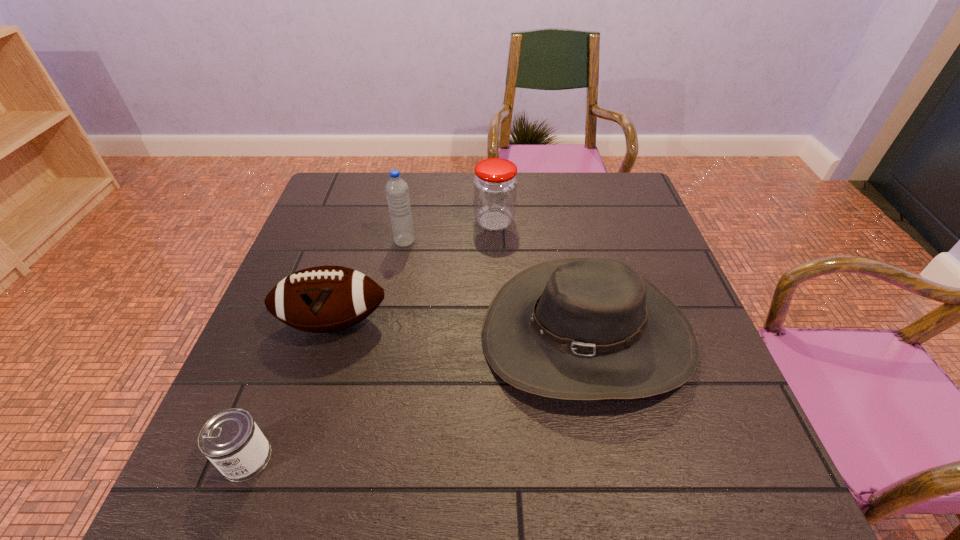
You are a GUI agent. You are given a task and a screenshot of the screen. Output one action in this format:
    pyautogui.click(x=<x>, y=<y>)
    Task: Click on the vacant space at the right edge
    The height and width of the screenshot is (540, 960).
    Given the screenshot: What is the action you would take?
    pyautogui.click(x=700, y=363)

Image resolution: width=960 pixels, height=540 pixels. What are the coordinates of `free space at the near left corner` in the screenshot? It's located at click(263, 498).

The height and width of the screenshot is (540, 960). I want to click on free region at the far right corner of the desktop, so 638,201.

This screenshot has height=540, width=960. Find the location of `vacant region at the near right corner of the desktop`. vacant region at the near right corner of the desktop is located at coordinates (725, 487).

This screenshot has height=540, width=960. What are the coordinates of `free space between the farthest object and the shortest object` in the screenshot? It's located at (371, 340).

Locate an element on the screen. This screenshot has width=960, height=540. free area in between the football (American) and the cowboy hat is located at coordinates (460, 329).

The image size is (960, 540). Identify the location of vacant space in between the cowboy hat and the football (American). (460, 329).

Find the location of a particular element. free point between the nearest object and the second farthest object is located at coordinates 325,349.

Find the location of a particular element. free space between the farthest object and the football (American) is located at coordinates pyautogui.click(x=414, y=272).

I want to click on vacant point located between the jar and the fourth nearest object, so click(449, 231).